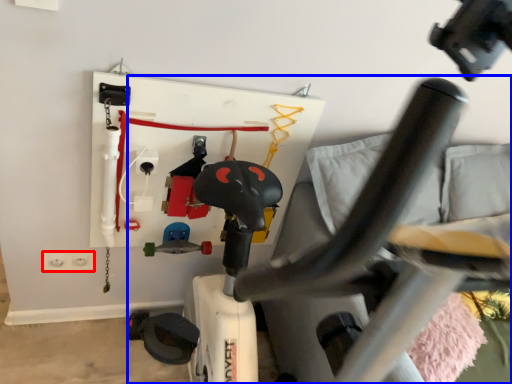
Question: Which point is closer to the camera, electric outlet (highlighted by a red box) or swivel chair (highlighted by a blue box)?

Choices:
 (A) electric outlet
 (B) swivel chair

Answer: (B)